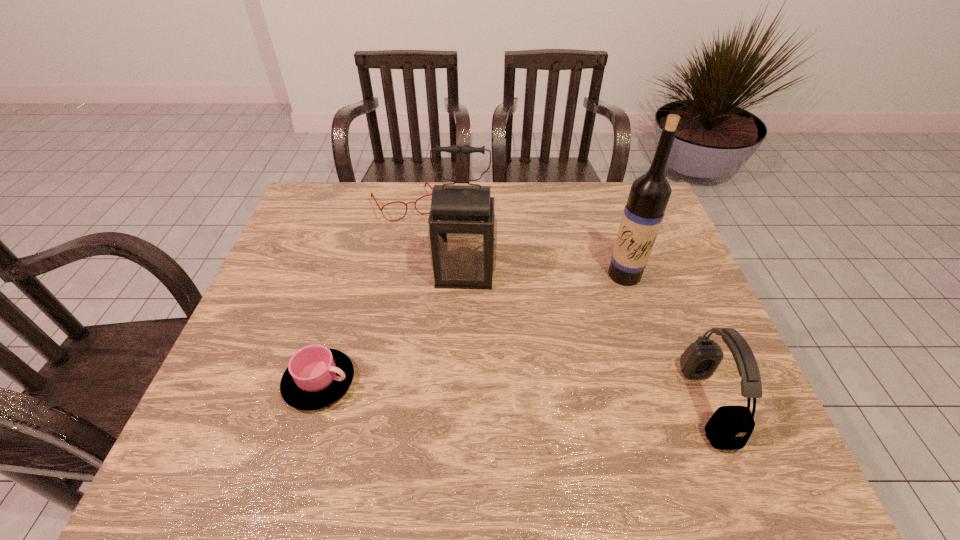
In the image, there is a desktop. Find the location of `vacant region at the far left corner`. vacant region at the far left corner is located at coordinates (300, 211).

This screenshot has height=540, width=960. Identify the location of vacant space at the far right corner. (614, 187).

This screenshot has width=960, height=540. Find the location of `empty space that is in between the second object from right to left and the second tallest object`. empty space that is in between the second object from right to left and the second tallest object is located at coordinates (544, 275).

At what (x,y) coordinates should I click in order to perform the action: click on blank region between the cup and the lantern. Please return your answer as a coordinate pair (x, y). The width and height of the screenshot is (960, 540). Looking at the image, I should click on (392, 328).

Locate an element on the screen. The image size is (960, 540). free spot between the headset and the spectacles is located at coordinates (x=556, y=303).

Image resolution: width=960 pixels, height=540 pixels. Find the location of `free spot between the fourth shortest object and the fourth object from left to right`. free spot between the fourth shortest object and the fourth object from left to right is located at coordinates (544, 275).

The image size is (960, 540). I want to click on unoccupied position between the spectacles and the cup, so click(x=363, y=293).

Where is `free space between the cup and the spectacles`? free space between the cup and the spectacles is located at coordinates (363, 293).

Image resolution: width=960 pixels, height=540 pixels. I want to click on vacant region between the lantern and the wine bottle, so click(x=544, y=275).

Find the location of a particular element. The image size is (960, 540). vacant area between the wine bottle and the spectacles is located at coordinates (515, 240).